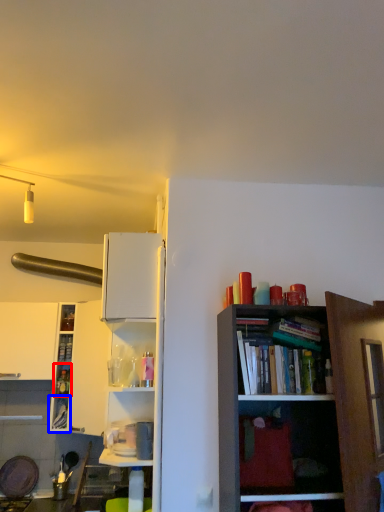
Question: Which of the following is the farthest to the observer, cabinet (highlighted by a red box) or cabinet (highlighted by a blue box)?

Choices:
 (A) cabinet
 (B) cabinet

Answer: (A)